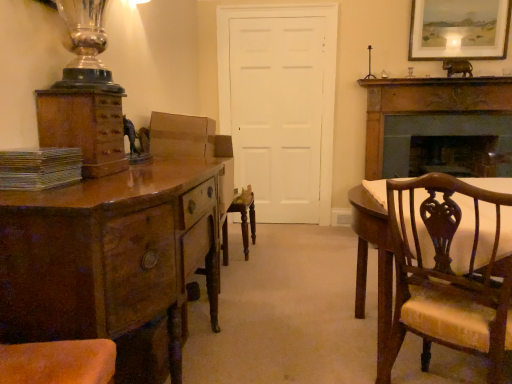
Question: Is point click(x=454, y=112) closer or farther from the camera than point click(x=489, y=39)?

Choices:
 (A) farther
 (B) closer

Answer: (A)

Question: In terms of size, does dark brown wood fireplace at right appear bigger or smaller than matte white picture frame at upper right?

Choices:
 (A) small
 (B) big

Answer: (B)

Question: Estimate the real-world distances between objects in this image. Which object is farther from the wooden carved chair at right?

Choices:
 (A) matte white picture frame at upper right
 (B) dark brown wood fireplace at right
 (C) metallic silver book at left
 (D) white matte door at center
 (E) brown wood cabinet at left

Answer: (A)

Question: Considering the real-world distances, which object is closest to the white matte door at center?

Choices:
 (A) shiny brown wood chest of drawers at left
 (B) matte white picture frame at upper right
 (C) brown wood cabinet at left
 (D) wooden carved chair at right
 (E) metallic silver book at left

Answer: (B)